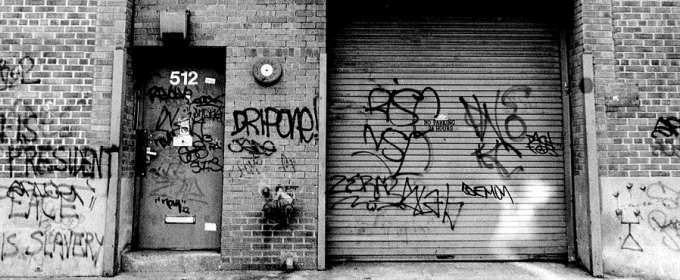
At what (x,y) coordinates should I click in order to perform the action: click on doorway. Please return your answer as a coordinate pair (x, y). Looking at the image, I should click on (190, 172).